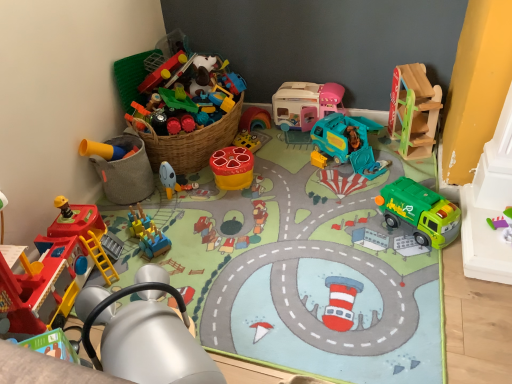
You are a GUI agent. You are given a task and a screenshot of the screen. Output one action in this format:
    pyautogui.click(x=<x>, y=<y>)
    Task: Click on the empty space that is in between green plastic garbage truck at lower right, which appears as the second toy when viewed from the right, and teal plastic garbage truck at center, acting as the 7th toy starting from the left
    The width and height of the screenshot is (512, 384).
    Given the screenshot: What is the action you would take?
    pyautogui.click(x=366, y=187)